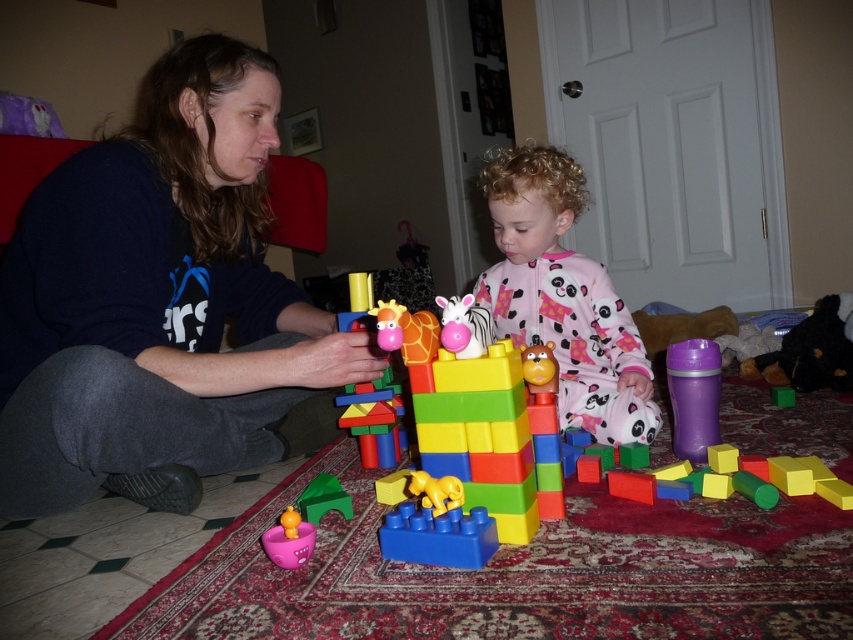
Question: Among these points, which one is nearest to the camera?

Choices:
 (A) (265, 532)
 (B) (660, 529)
 (C) (612, 333)

Answer: (A)

Question: Which point is farther from the camera taking this photo?

Choices:
 (A) (303, 515)
 (B) (109, 150)

Answer: (A)

Question: Can you confirm if rubberized plastic building blocks at center is positioned above green plastic boat at lower center?

Choices:
 (A) yes
 (B) no

Answer: (A)

Question: Which object is the closest to the green plastic boat at lower center?

Choices:
 (A) matte black sweater at left
 (B) pink fleece pajamas at center
 (C) matte plastic boat at lower left

Answer: (C)

Question: Can you confirm if pink fleece pajamas at center is bigger than matte plastic boat at lower left?

Choices:
 (A) no
 (B) yes

Answer: (B)

Question: Does pink fleece pajamas at center lie in front of matte plastic boat at lower left?

Choices:
 (A) yes
 (B) no

Answer: (B)